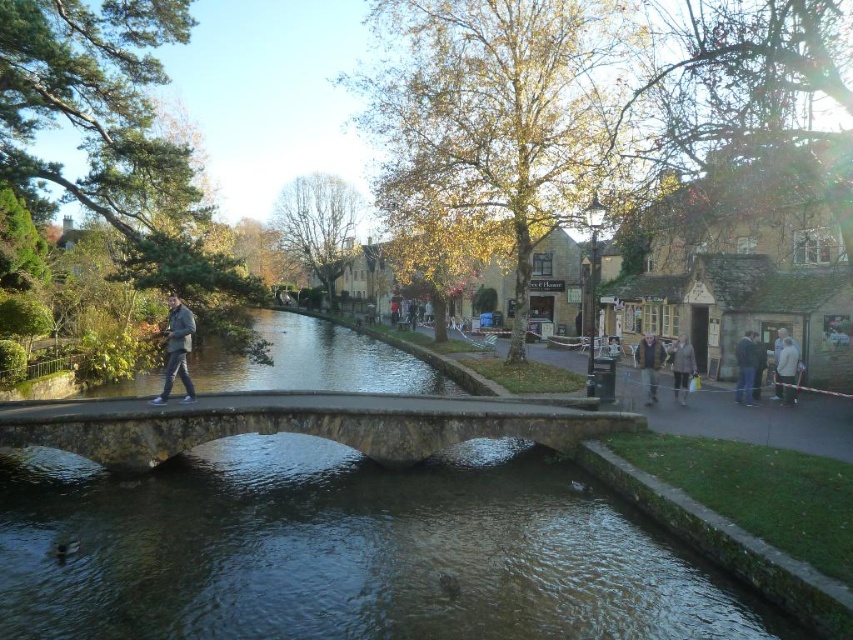
Based on the photo, you are a photographer planning to take a photo of the dark gray jacket at center and the blue denim jeans at right from a position on the stone bridge. Considering the distance between them, will you need to adjust your camera settings to ensure both are in focus simultaneously?

The distance between the dark gray jacket at center and the blue denim jeans at right is 46.41 feet. To ensure both are in focus simultaneously, you should use a smaller aperture setting to increase the depth of field, allowing both subjects at different distances to be sharp.

You are standing on the stone bridge and see a person wearing a dark gray jacket at center and blue denim jeans at right. Which clothing item is positioned more to the right side of the bridge?

The blue denim jeans at right is positioned more to the right side of the bridge than the dark gray jacket at center.